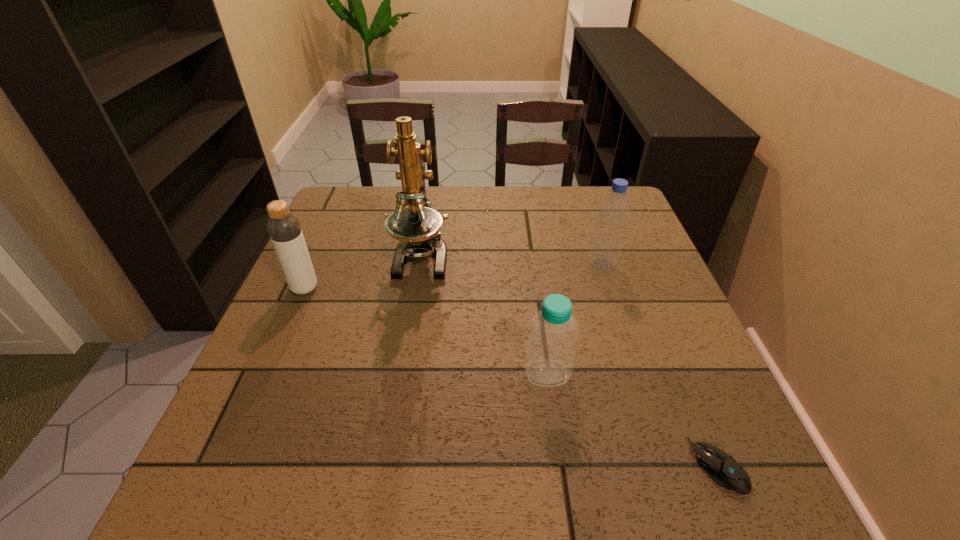
Identify the location of vacant space located 0.140m at the eyepiece of the tallest object. Image resolution: width=960 pixels, height=540 pixels. (409, 330).

Identify the location of free space located on the left of the fourth object from left to right. (477, 266).

Identify the location of free space located on the front of the leftmost bottle. The image size is (960, 540). (281, 340).

Where is `vacant space situated 0.080m on the right of the fourth farthest object`? vacant space situated 0.080m on the right of the fourth farthest object is located at coordinates (612, 373).

Locate an element on the screen. This screenshot has height=540, width=960. free region located 0.370m on the left of the rightmost object is located at coordinates (471, 466).

This screenshot has width=960, height=540. I want to click on object located at the near edge, so click(x=721, y=467).

The width and height of the screenshot is (960, 540). I want to click on object at the left edge, so click(x=284, y=229).

The height and width of the screenshot is (540, 960). Find the location of `bottle that is at the right edge`. bottle that is at the right edge is located at coordinates (614, 210).

Identify the location of computer mouse that is at the right edge. (721, 467).

Where is `object that is at the near right corner`? object that is at the near right corner is located at coordinates (721, 467).